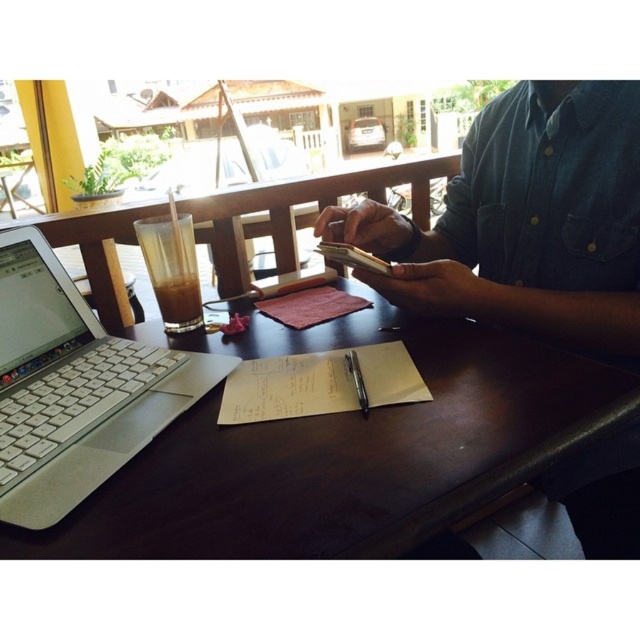
Question: Is translucent glass at left thinner than metallic silver pen at center?

Choices:
 (A) yes
 (B) no

Answer: (B)

Question: Which point is farther to the camera?

Choices:
 (A) translucent glass at left
 (B) dark blue denim shirt at upper right
 (C) matte paper notepad at center

Answer: (C)

Question: From the image, what is the correct spatial relationship of translucent glass at left in relation to matte paper notepad at center?

Choices:
 (A) below
 (B) above

Answer: (B)

Question: Which object is the farthest from the brown wooden table at center?

Choices:
 (A) metallic silver pen at center
 (B) matte paper notepad at center

Answer: (B)

Question: Among these points, which one is farthest from the camera?

Choices:
 (A) (252, 396)
 (B) (353, 355)
 (C) (196, 314)

Answer: (C)

Question: Is silver metallic laptop at left positioned before yellow paper notepad at center?

Choices:
 (A) yes
 (B) no

Answer: (A)